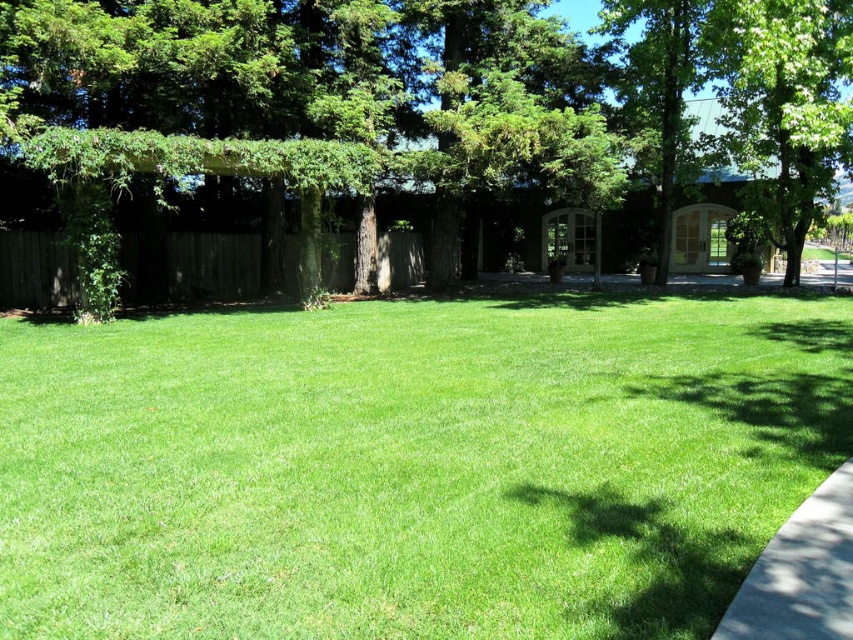
You are standing on the lawn and want to walk towards the green leafy tree at upper right. Which direction should you walk relative to the green leafy tree at center?

You should walk to the right relative to the green leafy tree at center because the green leafy tree at upper right is located to the right side of the green leafy tree at center.

You are planning to set up a picnic blanket in the center of the lawn. The picnic blanket is 2 meters wide. Considering the green grass at center and the green leafy tree at center, will the blanket fit without overlapping either of them?

The green grass at center has a larger width than the green leafy tree at center. Since the grass is wider, the 2 meter wide picnic blanket can fit within the grass area without overlapping the tree, provided the total width of the grass accommodates the blanket.

You are standing at the edge of the lawn in the image. If you walk straight towards the center, what will you first encounter at point coordinates (410, 465)?

At point coordinates (410, 465), you will first encounter green grass at center.